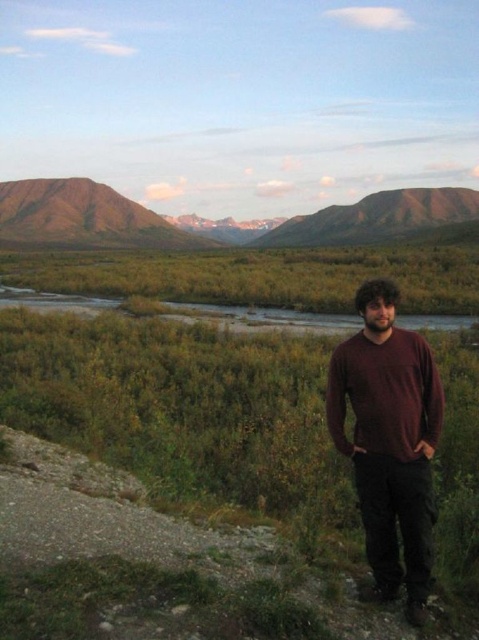
Looking at this image, you are a hiker planning to take a photo of the rugged brown mountain at upper left. Based on its position in the image, which direction should you face to capture it in your shot?

The rugged brown mountain at upper left is located at point (83, 218), which corresponds to the upper left area of the image. To capture it, you should face towards the upper left direction.

You are standing at the point with coordinates point (93, 218) and want to walk to the point with coordinates point (384, 227). Is the destination point in front of or behind you?

The destination point point (384, 227) is in front of you because point (93, 218) is behind point (384, 227).